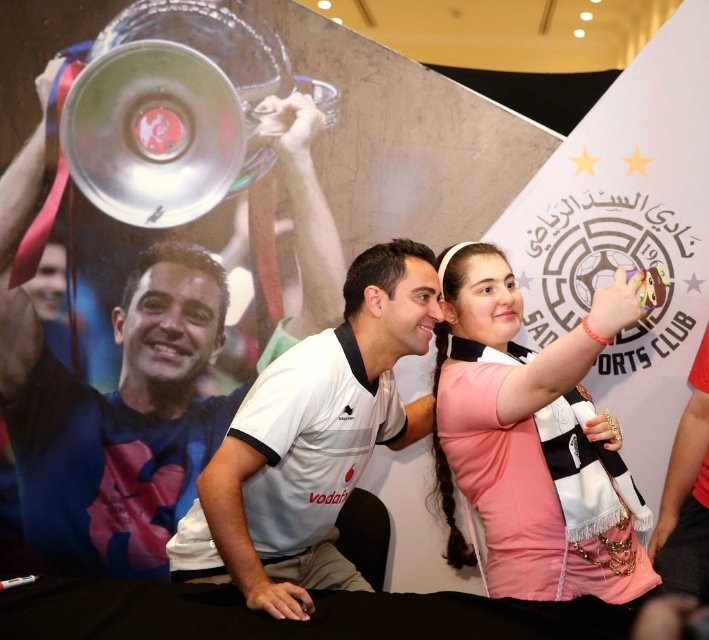
Question: Is pink fabric scarf at center wider than white matte shirt at center?

Choices:
 (A) yes
 (B) no

Answer: (B)

Question: Does metallic trophy at upper left appear under pink fabric scarf at center?

Choices:
 (A) yes
 (B) no

Answer: (B)

Question: Considering the real-world distances, which object is closest to the pink fabric scarf at center?

Choices:
 (A) white matte shirt at center
 (B) metallic trophy at upper left

Answer: (A)

Question: Is metallic trophy at upper left wider than white matte shirt at center?

Choices:
 (A) no
 (B) yes

Answer: (B)

Question: Which object is closer to the camera taking this photo?

Choices:
 (A) metallic trophy at upper left
 (B) pink fabric scarf at center

Answer: (B)

Question: Which is nearer to the pink fabric scarf at center?

Choices:
 (A) white matte shirt at center
 (B) metallic trophy at upper left

Answer: (A)